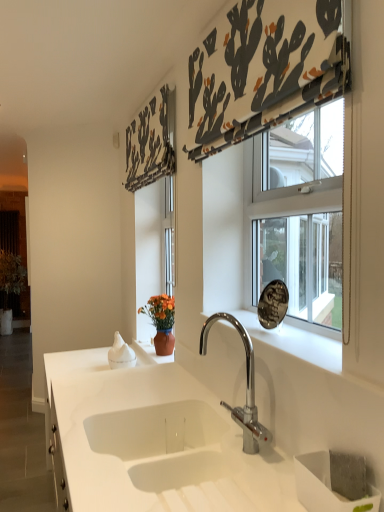
Question: From the image's perspective, is white marble window sill at center positioned above or below white fabric with cactus print at upper center, the second curtain in the left-to-right sequence?

Choices:
 (A) above
 (B) below

Answer: (B)

Question: In terms of size, does white marble window sill at center appear bigger or smaller than white fabric with cactus print at upper center, which is the first curtain in right-to-left order?

Choices:
 (A) small
 (B) big

Answer: (A)

Question: Estimate the real-world distances between objects in this image. Which object is farther from the white matte sink at center?

Choices:
 (A) white fabric with cactus print at upper center, which is the first curtain in right-to-left order
 (B) chrome metallic faucet at center
 (C) white marble window sill at center
 (D) wooden screen door at left
 (E) black fabric with cactus print at upper center, the second curtain viewed from the right

Answer: (D)

Question: Considering the real-world distances, which object is farthest from the wooden screen door at left?

Choices:
 (A) chrome metallic faucet at center
 (B) white matte sink at center
 (C) black fabric with cactus print at upper center, which ranks as the first curtain in left-to-right order
 (D) white fabric with cactus print at upper center, the first curtain when ordered from front to back
 (E) white marble window sill at center

Answer: (E)